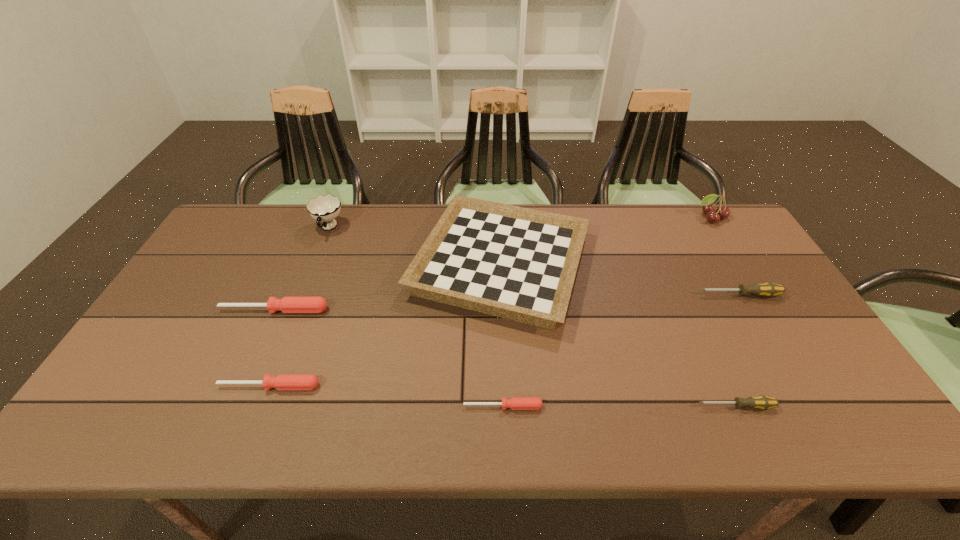
Locate an element on the screen. This screenshot has height=540, width=960. free point that satisfies the following two spatial constraints: 1. on the side of the white cup with the handle; 2. on the left side of the checkerboard is located at coordinates (314, 264).

This screenshot has width=960, height=540. What are the coordinates of `free space that satisfies the following two spatial constraints: 1. on the side of the third farthest screwdriver with the handle; 2. on the right side of the white cup` in the screenshot? It's located at (265, 386).

Find the location of a particular element. The image size is (960, 540). vacant space that satisfies the following two spatial constraints: 1. on the leaves of the cherry; 2. at the tip of the nearer gray screwdriver is located at coordinates (829, 406).

This screenshot has width=960, height=540. What are the coordinates of `vacant region that satisfies the following two spatial constraints: 1. on the front side of the second farthest red screwdriver; 2. on the left side of the third screwdriver from right to left` in the screenshot? It's located at (261, 407).

Find the location of `vacant point that satisfies the following two spatial constraints: 1. on the leaves of the red cherry; 2. at the tip of the smaller gray screwdriver`. vacant point that satisfies the following two spatial constraints: 1. on the leaves of the red cherry; 2. at the tip of the smaller gray screwdriver is located at coordinates (829, 406).

Locate an element on the screen. vacant space that satisfies the following two spatial constraints: 1. on the back side of the farthest red screwdriver; 2. on the left side of the sixth shortest object is located at coordinates (295, 264).